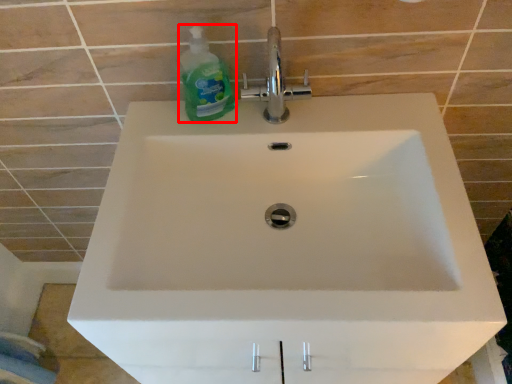
Question: From the image, what is the correct spatial relationship of cleaning product (annotated by the red box) in relation to tap?

Choices:
 (A) left
 (B) right

Answer: (A)